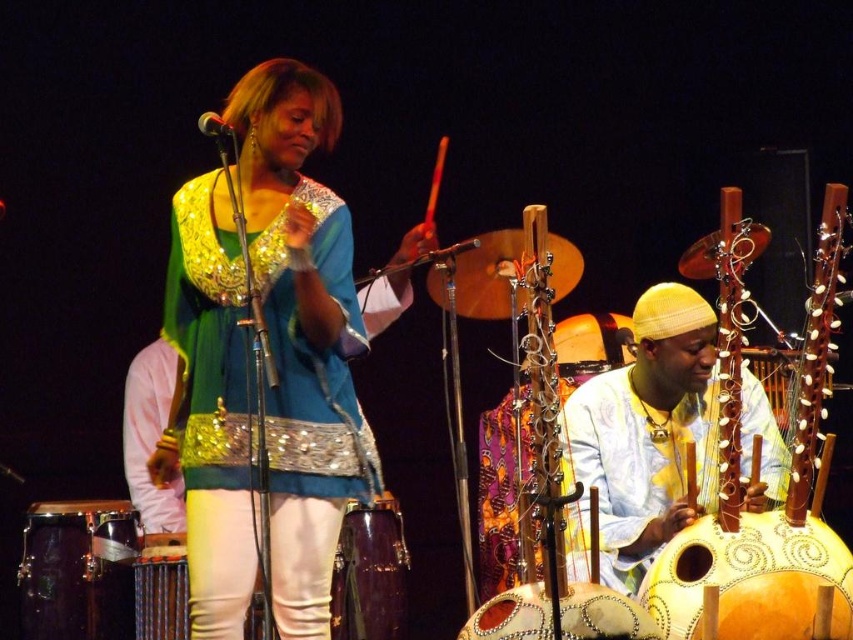
Based on the scene description, which drum is wider, the shiny metallic drum at lower left or the shiny purple drum at center?

The shiny metallic drum at lower left is wider than the shiny purple drum at center.

You are a stagehand who needs to adjust the microphone stand between the shiny metallic drum at lower left and the shiny purple drum at center. Based on their positions, which drum should the microphone stand be closer to?

The shiny metallic drum at lower left is in front of the shiny purple drum at center, so the microphone stand should be placed closer to the shiny metallic drum at lower left to avoid blocking the performer.

You are a stagehand standing at the camera position. You need to place a new monitor at point (x=686, y=618). The monitor requires a 10 foot clearance from the stagehand to ensure safety. Is the distance sufficient?

The distance between the camera and point (x=686, y=618) is 14.11 feet, which is greater than the required 10 foot clearance. Therefore, the distance is sufficient for placing the monitor safely.